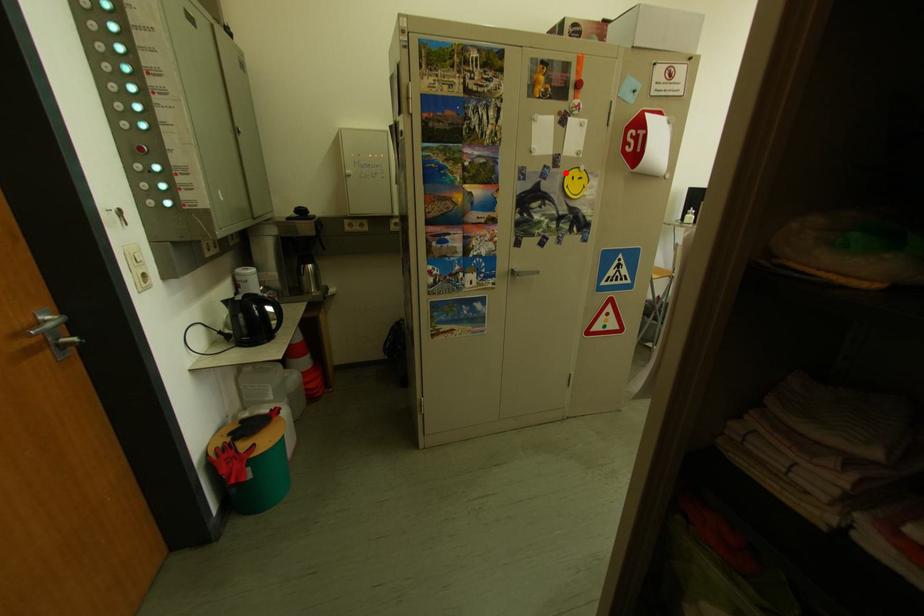
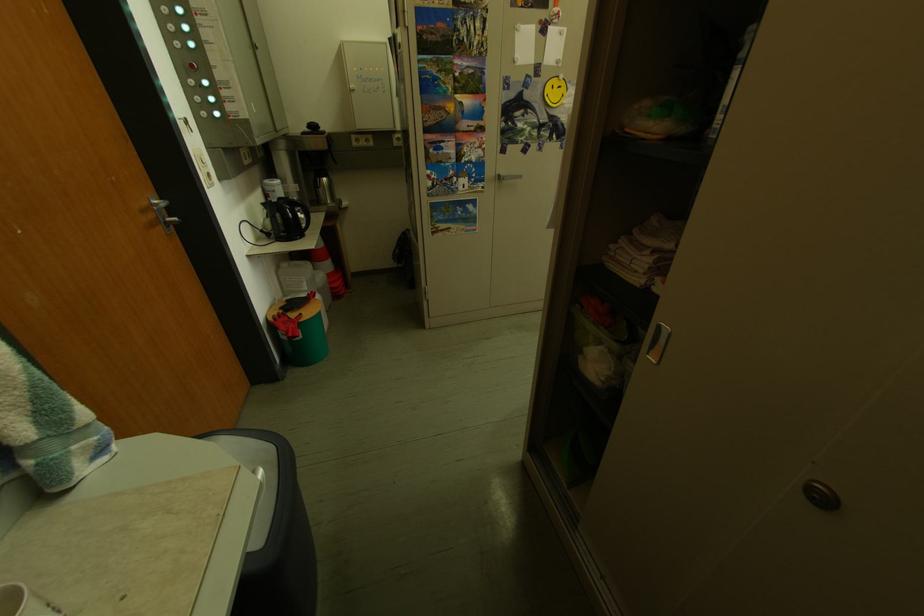
Find the pixel in the second image that matches the highlighted location in the first image.

(546, 82)